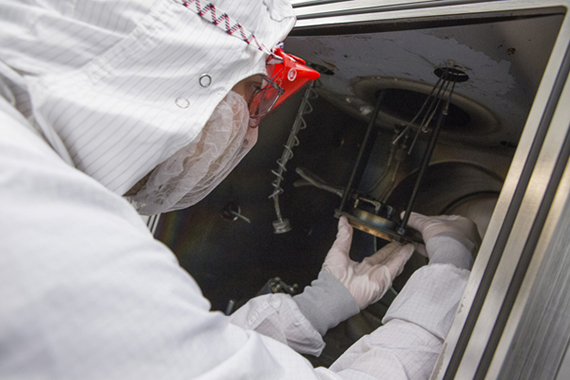
Locate an element on the screen. hood is located at coordinates (238, 6).